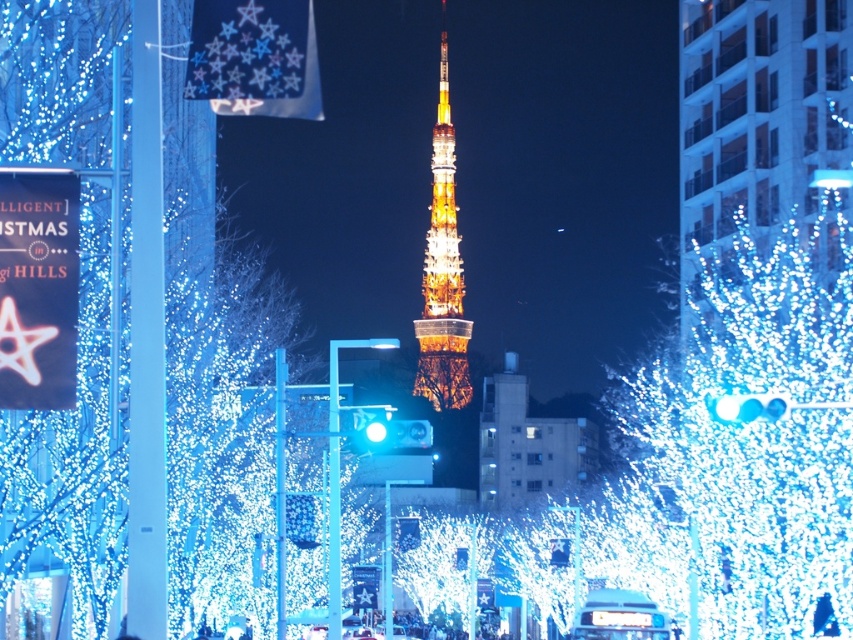
Question: Can you confirm if illuminated metal tower at center is positioned above blue frosted bulb at center?

Choices:
 (A) no
 (B) yes

Answer: (B)

Question: Among these points, which one is farthest from the camera?

Choices:
 (A) [x=828, y=104]
 (B) [x=726, y=400]
 (C) [x=428, y=269]

Answer: (C)

Question: Can you confirm if illuminated metal tower at center is positioned to the right of blue frosted bulb at center?

Choices:
 (A) yes
 (B) no

Answer: (B)

Question: Which of the following is the closest to the observer?

Choices:
 (A) illuminated metal tower at center
 (B) blue frosted bulb at center
 (C) illuminated glass tower at center

Answer: (B)

Question: Which point is farther from the camera taking this photo?

Choices:
 (A) (456, 323)
 (B) (747, 45)

Answer: (A)

Question: Is illuminated glass tower at center bigger than blue frosted bulb at center?

Choices:
 (A) yes
 (B) no

Answer: (A)